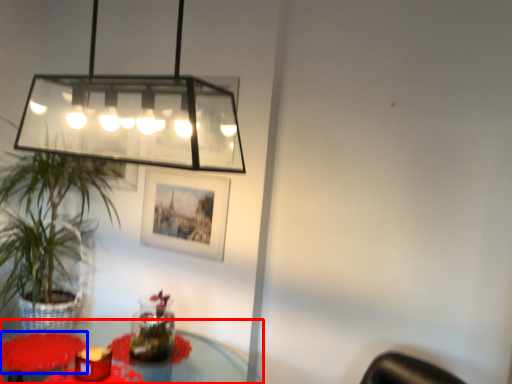
Question: Which object appears farthest to the camera in this image, table (highlighted by a red box) or flower (highlighted by a blue box)?

Choices:
 (A) table
 (B) flower

Answer: (B)